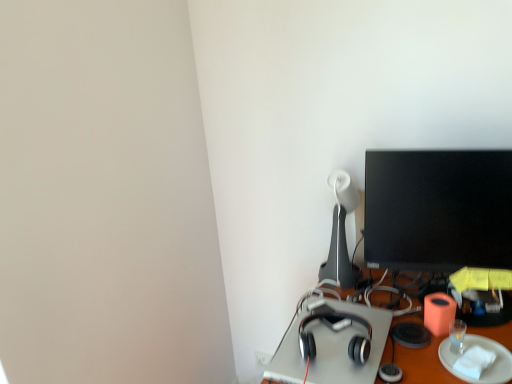
Question: Is satin silver headphones at center-right taller or shorter than white glossy table lamp at upper right?

Choices:
 (A) short
 (B) tall

Answer: (A)

Question: Would you say satin silver headphones at center-right is to the left or to the right of white glossy table lamp at upper right in the picture?

Choices:
 (A) right
 (B) left

Answer: (B)

Question: Which is nearer to the white glossy table lamp at upper right?

Choices:
 (A) satin silver headphones at center-right
 (B) white paper plate at lower right
 (C) black glossy monitor at upper right

Answer: (C)

Question: Estimate the real-world distances between objects in this image. Which object is closer to the white paper plate at lower right?

Choices:
 (A) satin silver headphones at center-right
 (B) black glossy monitor at upper right
 (C) white glossy table lamp at upper right

Answer: (A)